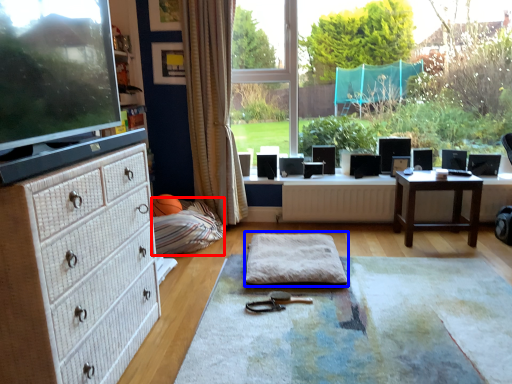
Question: Among these objects, which one is nearest to the camera, bean bag chair (highlighted by a red box) or yoga mat (highlighted by a blue box)?

Choices:
 (A) bean bag chair
 (B) yoga mat

Answer: (B)